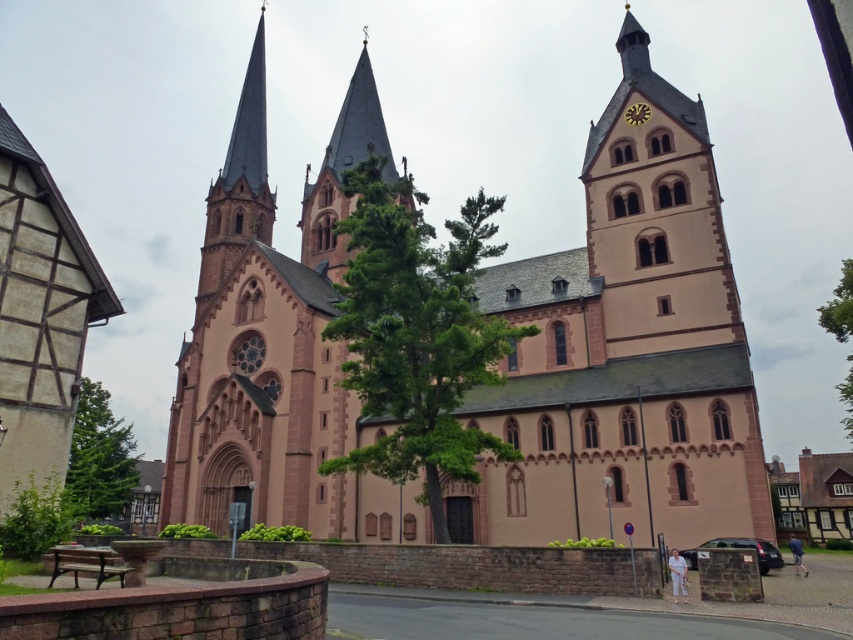
Question: Considering the real-world distances, which object is farthest from the green leafy tree at lower left?

Choices:
 (A) yellow plastic clock at upper center
 (B) green leafy tree at center
 (C) smooth pink stone tower at center
 (D) pink stone spire at upper left

Answer: (A)

Question: Does green leafy tree at center appear over green leafy tree at right?

Choices:
 (A) no
 (B) yes

Answer: (B)

Question: Which point appears closest to the camera in this image?

Choices:
 (A) (851, 428)
 (B) (224, 244)
 (C) (418, 312)
 (D) (646, 312)

Answer: (C)

Question: Does green leafy tree at center come behind green leafy tree at lower left?

Choices:
 (A) no
 (B) yes

Answer: (B)

Question: Considering the real-world distances, which object is farthest from the pink stone spire at upper left?

Choices:
 (A) green leafy tree at lower left
 (B) pink stone church at center
 (C) green leafy tree at right

Answer: (C)

Question: Is green leafy tree at center to the left of green leafy tree at right from the viewer's perspective?

Choices:
 (A) yes
 (B) no

Answer: (A)